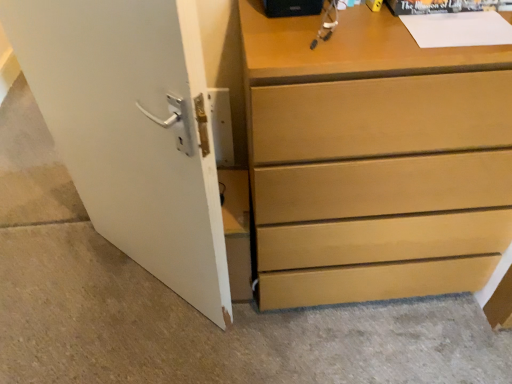
Question: In the image, is matte wood chest of drawers at center positioned in front of or behind white matte door at left?

Choices:
 (A) front
 (B) behind

Answer: (B)

Question: Would you say matte wood chest of drawers at center is to the left or to the right of white matte door at left in the picture?

Choices:
 (A) right
 (B) left

Answer: (A)

Question: From a real-world perspective, is matte wood chest of drawers at center above or below white matte door at left?

Choices:
 (A) above
 (B) below

Answer: (B)

Question: In terms of width, does white matte door at left look wider or thinner when compared to matte wood chest of drawers at center?

Choices:
 (A) thin
 (B) wide

Answer: (A)

Question: Considering the positions of white matte door at left and matte wood chest of drawers at center in the image, is white matte door at left bigger or smaller than matte wood chest of drawers at center?

Choices:
 (A) big
 (B) small

Answer: (B)

Question: From the image's perspective, is white matte door at left above or below matte wood chest of drawers at center?

Choices:
 (A) above
 (B) below

Answer: (B)

Question: Is white matte door at left spatially inside matte wood chest of drawers at center, or outside of it?

Choices:
 (A) outside
 (B) inside

Answer: (A)